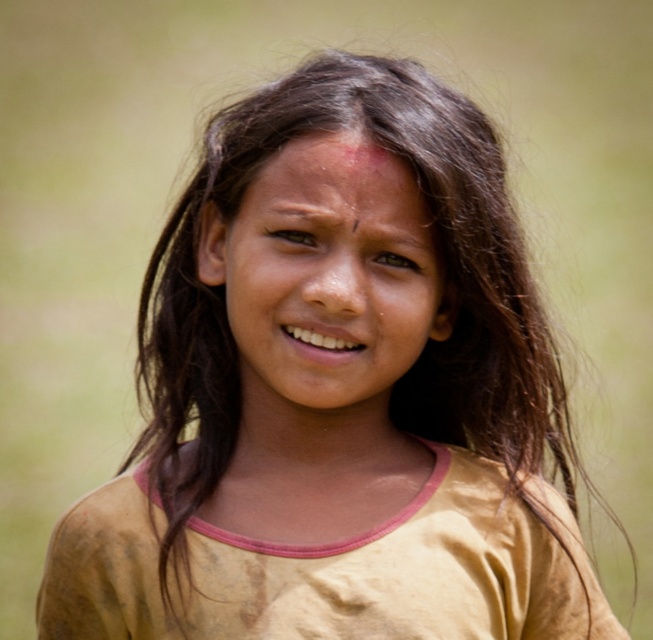
Question: Can you confirm if smooth skin face at center is thinner than smooth skin forehead at center?

Choices:
 (A) yes
 (B) no

Answer: (B)

Question: Is smooth skin face at center bigger than smooth skin forehead at center?

Choices:
 (A) yes
 (B) no

Answer: (A)

Question: Among these points, which one is nearest to the camera?

Choices:
 (A) (289, 179)
 (B) (411, 250)

Answer: (A)

Question: Which point is farther to the camera?

Choices:
 (A) smooth skin forehead at center
 (B) smooth skin face at center

Answer: (A)

Question: Which point is closer to the camera?

Choices:
 (A) smooth skin forehead at center
 (B) smooth skin face at center

Answer: (B)

Question: Does smooth skin face at center appear on the right side of smooth skin forehead at center?

Choices:
 (A) no
 (B) yes

Answer: (A)